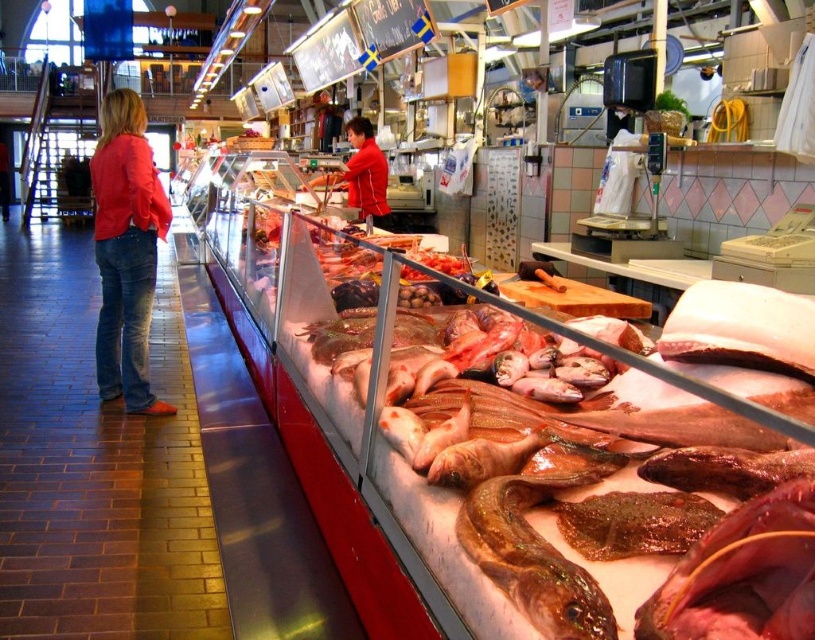
In the fish market scene, there are two fish displayed in the refrigerated case. The shiny red fish at center and the shiny brown fish at center. Which one is positioned higher?

The shiny red fish at center is above the shiny brown fish at center.

You are a customer at the fish market and want to buy the shiny red fish at center and the matte red shirt at center. Since both items are at the center, which one is easier to reach if you are standing directly in front of the display case?

The shiny red fish at center is easier to reach because it occupies less space than the matte red shirt at center, making it more accessible when standing directly in front of the display case.

You are a photographer standing at the end of the aisle. You want to take a photo of the denim jeans at left and the matte red shirt at center without any obstruction. Based on their positions, which one should you focus on first to ensure both are in the frame?

The denim jeans at left is positioned under the matte red shirt at center, so you should focus on the matte red shirt at center first to ensure both are visible in the frame without obstruction.